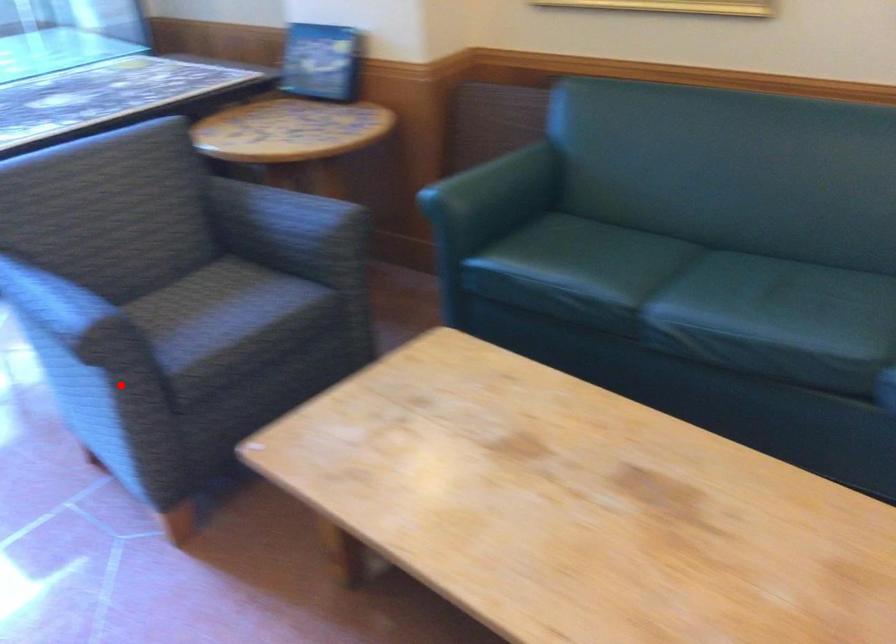
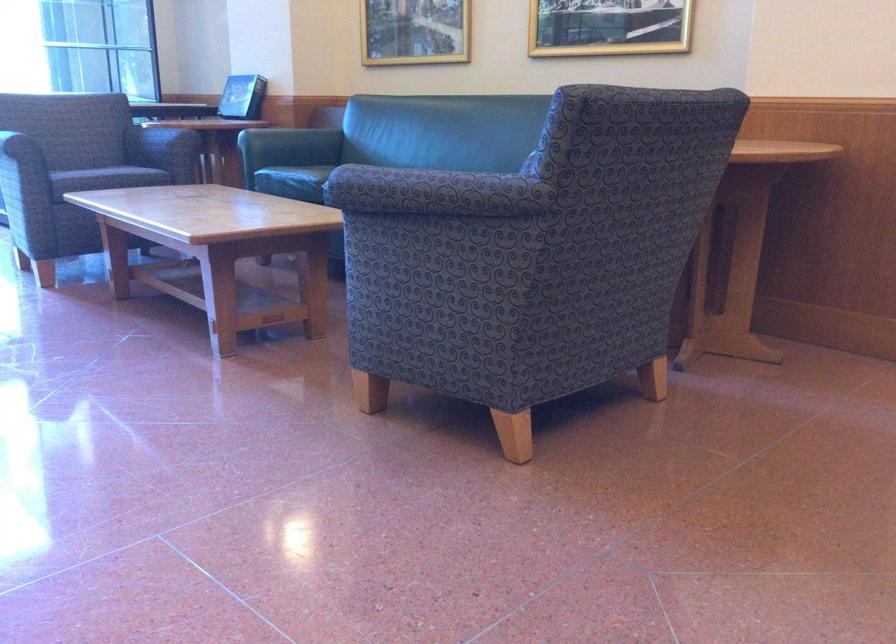
Question: I am providing you with two images of the same scene from different viewpoints. A red point is shown in image1. For the corresponding object point in image2, is it positioned nearer or farther from the camera?

Choices:
 (A) Nearer
 (B) Farther

Answer: (B)